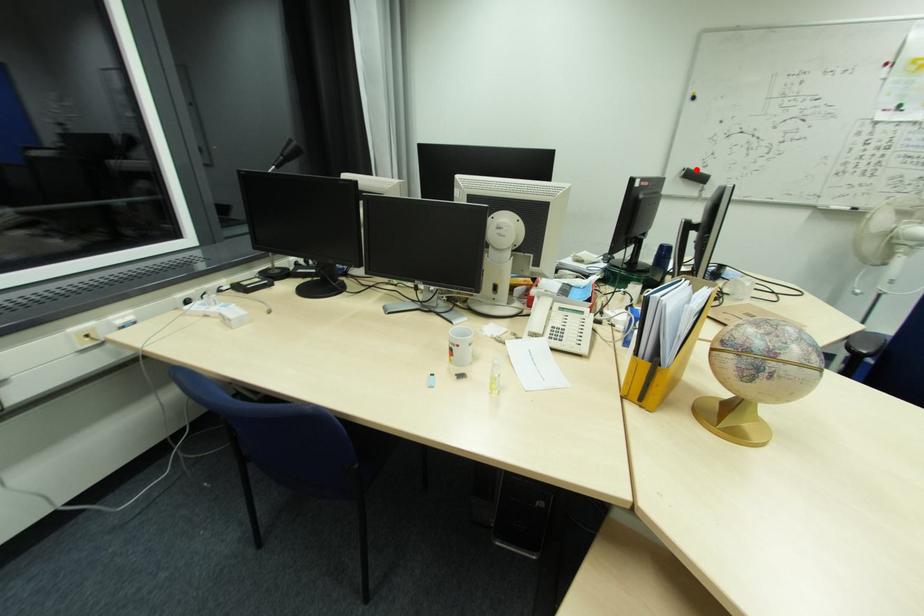
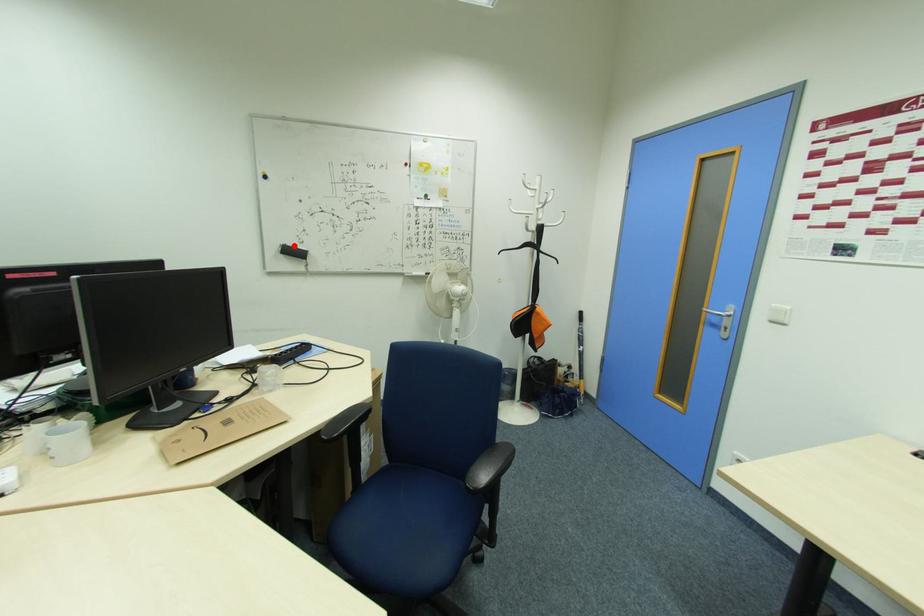
I am providing you with two images of the same scene from different viewpoints. A red point is marked on the first image and another point is marked on the second image. Does the point marked in image1 correspond to the same location as the one in image2?

Yes